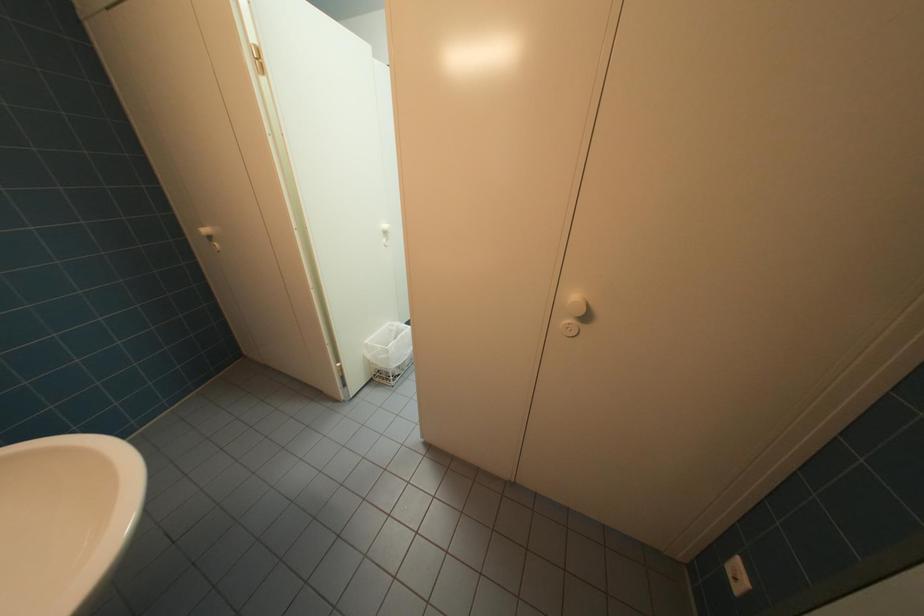
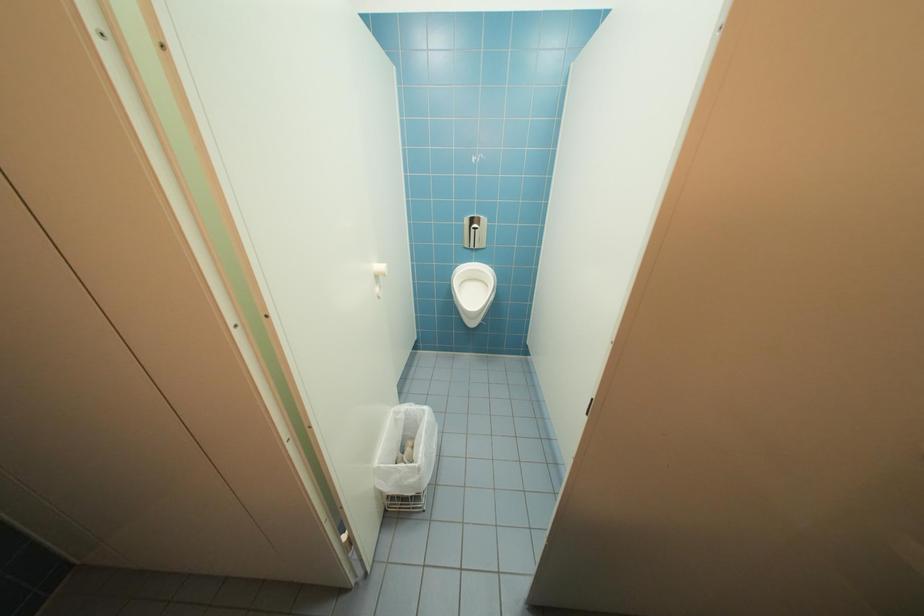
Question: Based on the continuous images, in which direction is the camera rotating? Reply with the corresponding letter.

Choices:
 (A) Left
 (B) Right
 (C) Up
 (D) Down

Answer: (B)